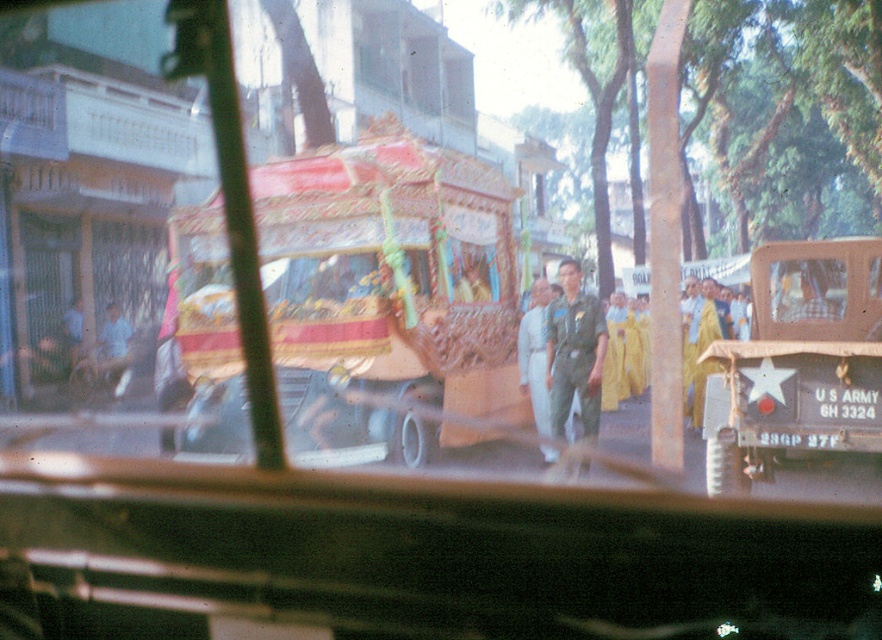
You are a passenger in the vehicle and want to know what is located at the point marked as (797, 362) on the image. What object is at that coordinate?

The camouflage fabric food truck at right is located at point (797, 362).

You are a photographer inside a moving vehicle, and you need to capture a clear photo of both the decorative wood cart at center and the green uniform at center. Given their sizes, which one should you focus on to ensure it fills the frame better?

The decorative wood cart at center has a larger size compared to the green uniform at center, so focusing on it will better fill the frame.

You are a photographer inside a moving vehicle and want to capture both the decorative wood cart at center and the green uniform at center in a single photo. Based on their positions, which object should you adjust your camera to focus on first to ensure both are in frame?

The decorative wood cart at center is positioned on the left side of green uniform at center. To capture both in a single photo, focus on the decorative wood cart at center first as it is on the left, ensuring the green uniform at center remains within the frame to the right.